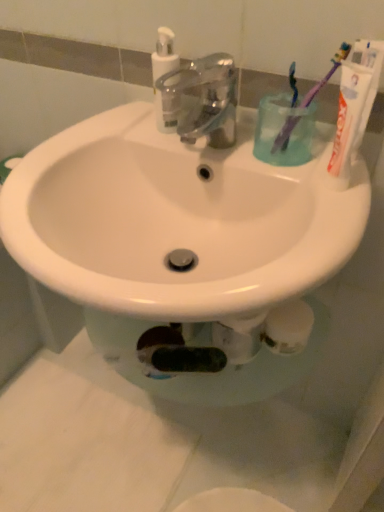
You are a GUI agent. You are given a task and a screenshot of the screen. Output one action in this format:
    pyautogui.click(x=<x>, y=<y>)
    Task: Click on the unoccupied area in front of purple plastic toothbrush at upper right, placed as the 2th toothbrush when sorted from right to left
    
    Given the screenshot: What is the action you would take?
    pyautogui.click(x=319, y=196)